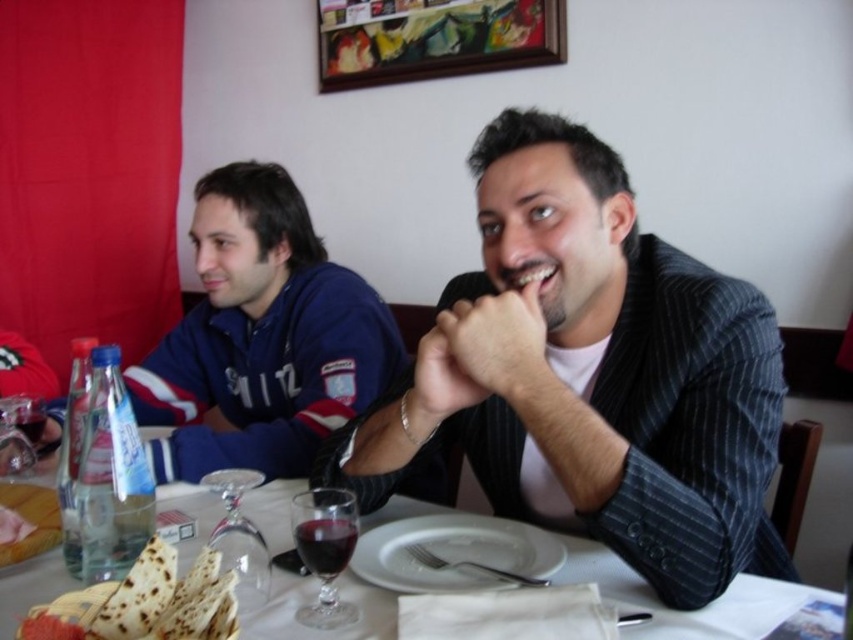
Is striped suit jacket at center shorter than wooden picture frame at upper center?

No.

Does striped suit jacket at center lie in front of wooden picture frame at upper center?

Yes, it is in front of wooden picture frame at upper center.

What do you see at coordinates (590, 374) in the screenshot?
I see `striped suit jacket at center` at bounding box center [590, 374].

Image resolution: width=853 pixels, height=640 pixels. Identify the location of striped suit jacket at center. (590, 374).

Which is more to the right, golden crispy flatbread at lower left or transparent glass wine glass at lower left?

golden crispy flatbread at lower left

Does point (146, 634) lie behind point (231, 564)?

No, (146, 634) is in front of (231, 564).

You are a GUI agent. You are given a task and a screenshot of the screen. Output one action in this format:
    pyautogui.click(x=<x>, y=<y>)
    Task: Click on the golden crispy flatbread at lower left
    This screenshot has height=640, width=853.
    Given the screenshot: What is the action you would take?
    pyautogui.click(x=144, y=602)

Is point (534, 211) farther from camera compared to point (351, 528)?

Yes.

Is striped suit jacket at center in front of transparent glass wine glass at center?

Yes, it is in front of transparent glass wine glass at center.

Does point (662, 314) lie behind point (351, 554)?

That is True.

What are the coordinates of `striped suit jacket at center` in the screenshot? It's located at (590, 374).